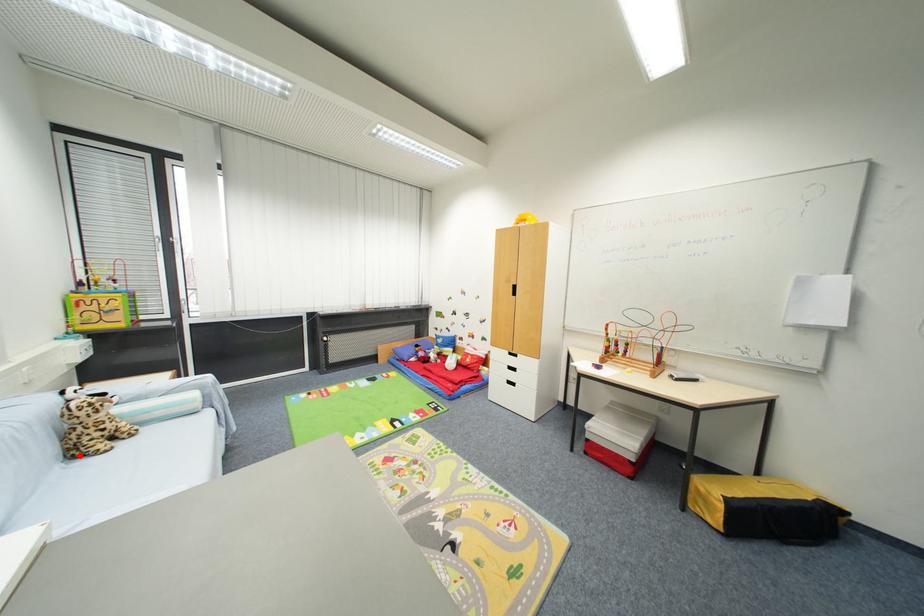
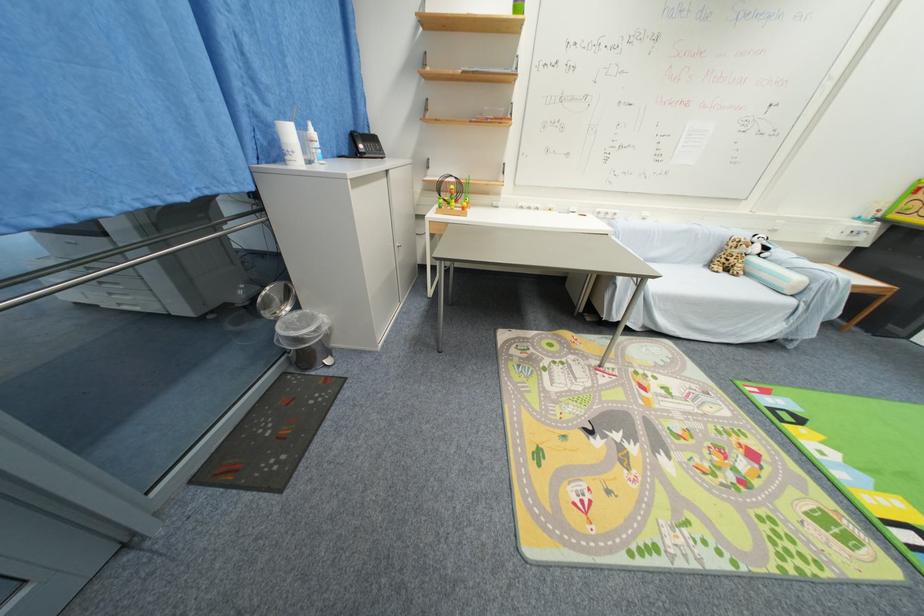
Question: I am providing you with two images of the same scene from different viewpoints. Image1 has a red point marked. In image2, the corresponding 3D location appears at what relative position? Reply with the corresponding letter.

Choices:
 (A) Closer
 (B) Farther

Answer: (A)